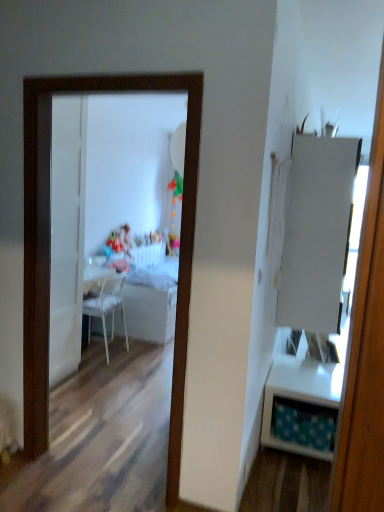
The height and width of the screenshot is (512, 384). In order to click on empty space that is ontop of white glossy mirror at center (from a real-world perspective) in this screenshot , I will do pos(96,69).